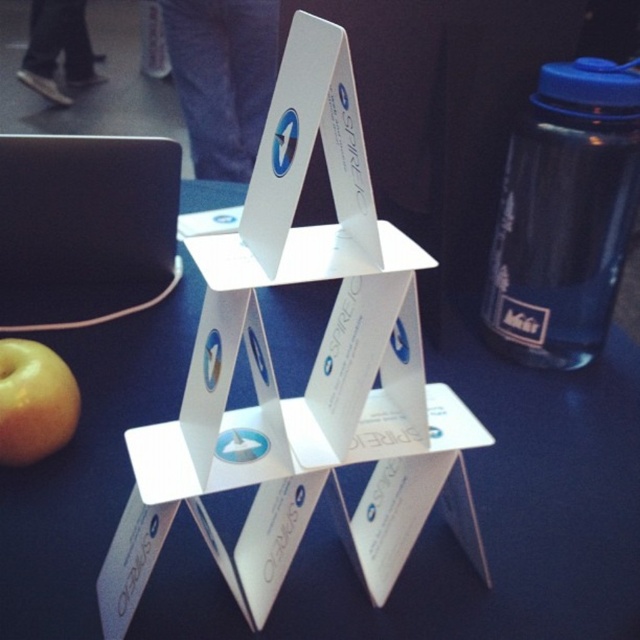
You are organizing a small event and need to place a decorative item on the table. The white cardboard structure at center and the blue plastic bottle at right are both on the table. Which one takes up more space on the table?

The white cardboard structure at center takes up more space on the table because it is bigger than the blue plastic bottle at right.